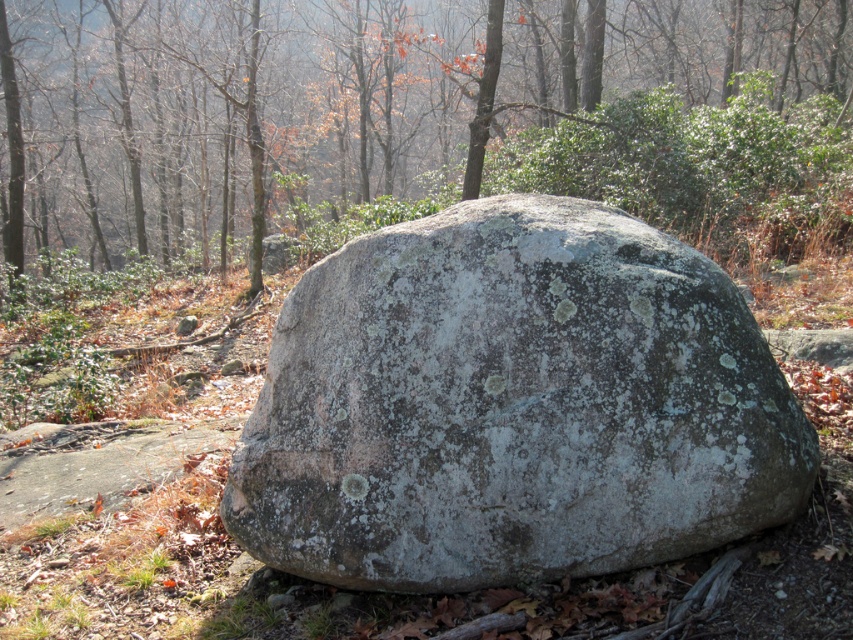
Question: Considering the relative positions of green lichen-covered rock at center and speckled gray rock at center in the image provided, where is green lichen-covered rock at center located with respect to speckled gray rock at center?

Choices:
 (A) right
 (B) left

Answer: (B)

Question: Is green lichen-covered rock at center closer to the viewer compared to speckled gray rock at center?

Choices:
 (A) no
 (B) yes

Answer: (A)

Question: In this image, where is green lichen-covered rock at center located relative to speckled gray rock at center?

Choices:
 (A) left
 (B) right

Answer: (A)